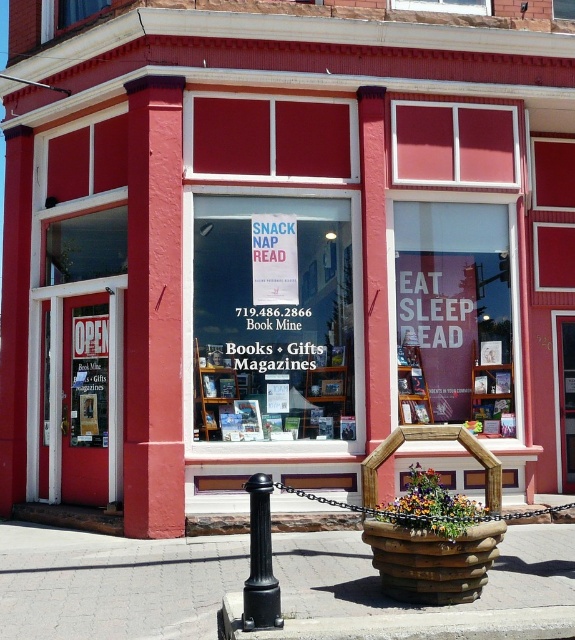
Between brick pavement at lower center and black plastic pole at lower center, which one has less height?

brick pavement at lower center

Can you confirm if brick pavement at lower center is wider than black plastic pole at lower center?

Yes, brick pavement at lower center is wider than black plastic pole at lower center.

Is point (36, 618) farther from viewer compared to point (274, 624)?

Yes, point (36, 618) is farther from viewer.

Identify the location of brick pavement at lower center. This screenshot has width=575, height=640. (113, 584).

Which is in front, point (214, 577) or point (481, 620)?

Point (481, 620) is in front.

Does brick pavement at lower center have a smaller size compared to concrete at lower center?

Yes.

The width and height of the screenshot is (575, 640). Identify the location of brick pavement at lower center. (113, 584).

Is point (492, 636) closer to viewer compared to point (262, 573)?

Yes, point (492, 636) is in front of point (262, 573).

Can you confirm if concrete at lower center is taller than black plastic pole at lower center?

Incorrect, concrete at lower center's height is not larger of black plastic pole at lower center's.

Locate an element on the screen. concrete at lower center is located at coordinates (412, 625).

Where is `concrete at lower center`? This screenshot has width=575, height=640. concrete at lower center is located at coordinates (412, 625).